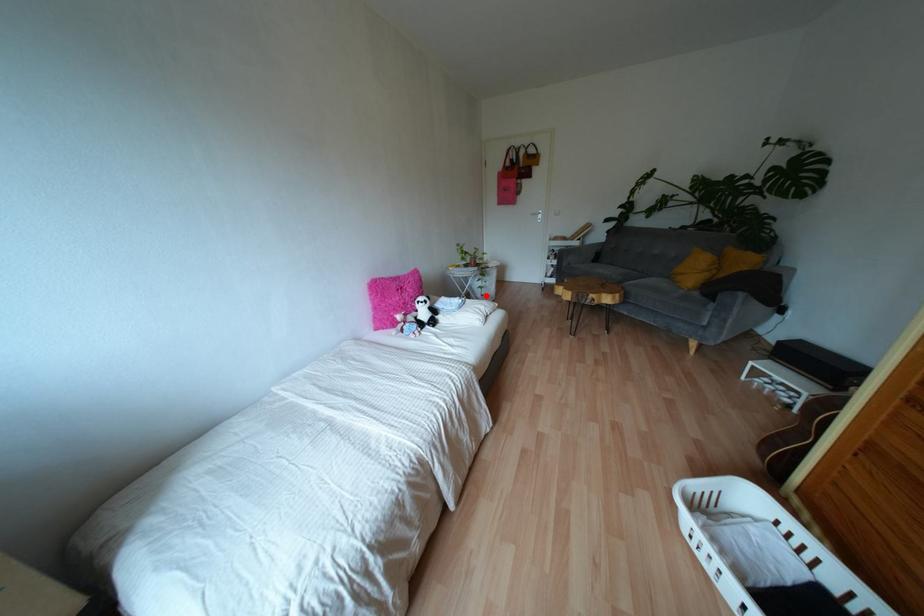
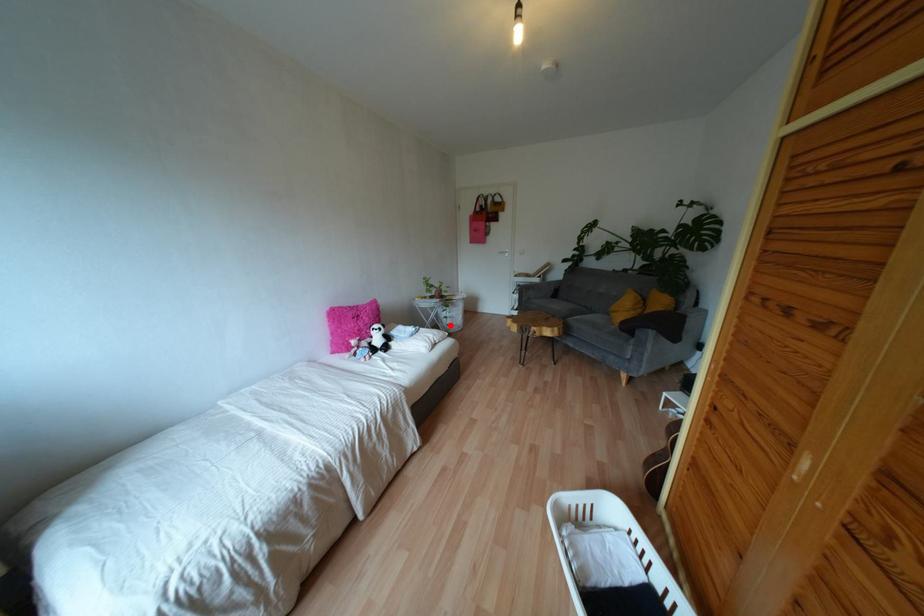
I am providing you with two images of the same scene from different viewpoints. A red point is marked on the first image and another point is marked on the second image. Does the point marked in image1 correspond to the same location as the one in image2?

Yes